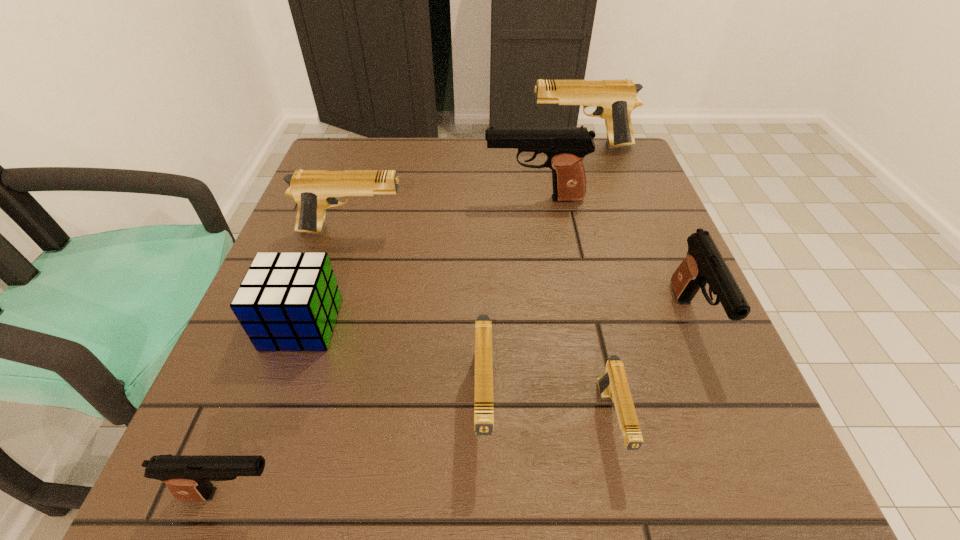
Find the location of a particular element. Image resolution: width=960 pixels, height=540 pixels. free space at the left edge of the desktop is located at coordinates (365, 197).

The width and height of the screenshot is (960, 540). In the image, there is a desktop. In order to click on vacant area at the right edge in this screenshot , I will do `click(638, 305)`.

Image resolution: width=960 pixels, height=540 pixels. In order to click on free point at the far left corner in this screenshot , I will do `click(342, 143)`.

Where is `blank space at the far right corner of the desktop`? blank space at the far right corner of the desktop is located at coordinates (635, 154).

This screenshot has width=960, height=540. Find the location of `free space between the farthest tan pistol and the leftmost black pistol`. free space between the farthest tan pistol and the leftmost black pistol is located at coordinates (407, 320).

Identify the location of vacant space in between the leftmost black pistol and the second tan pistol from left to right. Image resolution: width=960 pixels, height=540 pixels. (358, 448).

The height and width of the screenshot is (540, 960). Identify the location of free space between the farthest pistol and the third nearest tan pistol. (467, 188).

Identify the location of vacant space that's between the nearest black pistol and the shortest pistol. The width and height of the screenshot is (960, 540). coord(422,458).

Locate an element on the screen. Image resolution: width=960 pixels, height=540 pixels. free space between the smallest tan pistol and the second smallest tan pistol is located at coordinates (547, 413).

The height and width of the screenshot is (540, 960). Find the location of `vacant space that's between the rightmost black pistol and the second smallest tan pistol`. vacant space that's between the rightmost black pistol and the second smallest tan pistol is located at coordinates (588, 361).